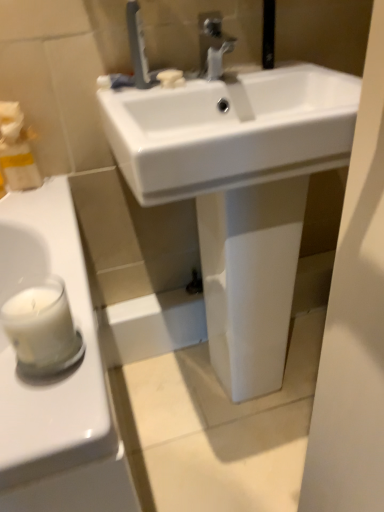
Find the location of a particular element. free location to the left of matte silver faucet at upper center, which is the 1th tap in right-to-left order is located at coordinates tap(170, 81).